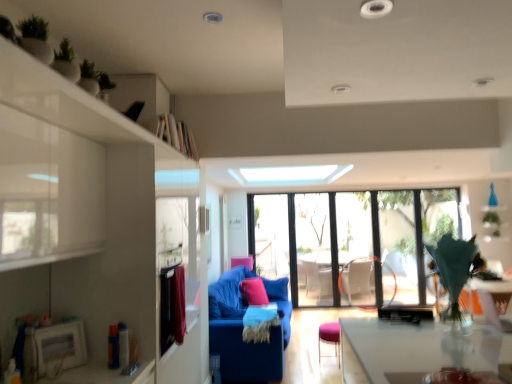
Question: Looking at their shapes, would you say green matte plant at upper left, which is the 1th plant in front-to-back order, is wider or thinner than green leafy plant in vase at right, the third plant from the top?

Choices:
 (A) wide
 (B) thin

Answer: (B)

Question: From a real-world perspective, relative to green leafy plant in vase at right, the 2th plant viewed from the front, is green matte plant at upper left, which appears as the 1th plant when viewed from the left, vertically above or below?

Choices:
 (A) above
 (B) below

Answer: (A)

Question: Which of these objects is positioned closest to the green matte plant at upper right, which is counted as the first plant, starting from the back?

Choices:
 (A) pink fabric pillow at center
 (B) white glossy table at lower right
 (C) green leafy plant in vase at right, which is the first plant from bottom to top
 (D) pink fabric armchair at center
 (E) transparent glass window at center

Answer: (E)

Question: Estimate the real-world distances between objects in this image. Which object is closer to the green matte plant at upper right, the 3th plant when ordered from left to right?

Choices:
 (A) pink fabric pillow at center
 (B) metallic silver swivel chair at center
 (C) pink fabric armchair at center
 (D) transparent glass window at center
 (E) velvet blue couch at center

Answer: (D)